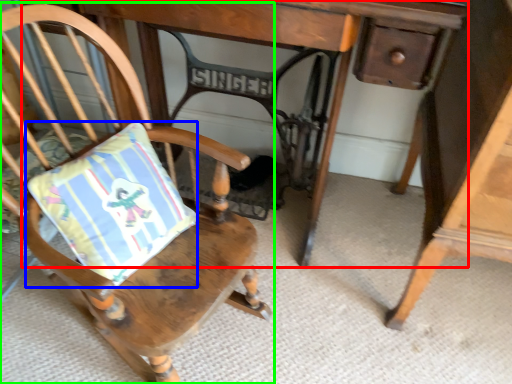
Question: Based on their relative distances, which object is farther from table (highlighted by a red box)? Choose from pillow (highlighted by a blue box) and chair (highlighted by a green box).

Choices:
 (A) pillow
 (B) chair

Answer: (A)